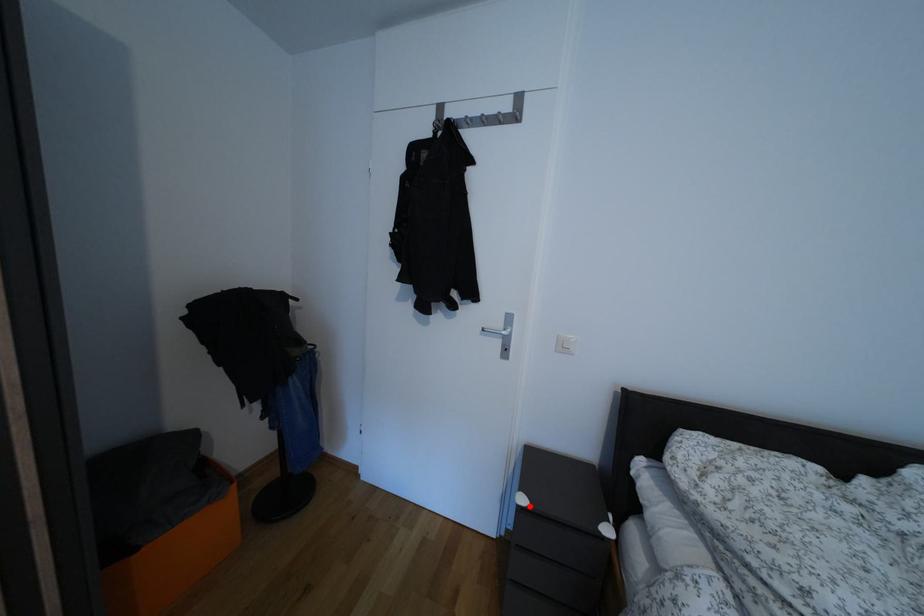
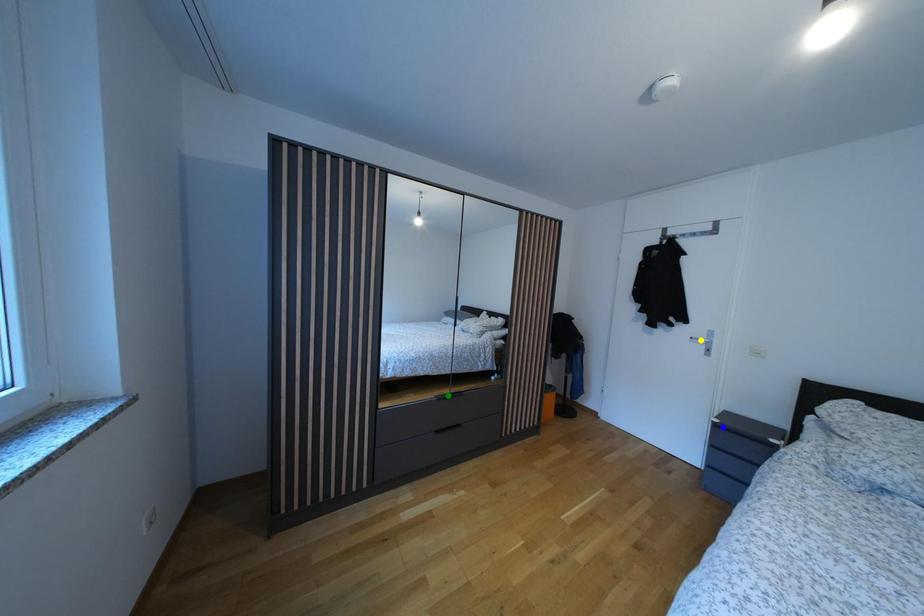
Question: I am providing you with two images of the same scene from different viewpoints. A red point is marked on the first image. You are given multiple points on the second image. In image 2, which mark is for the same physical point as the one in image 1?

Choices:
 (A) green point
 (B) yellow point
 (C) blue point

Answer: (C)